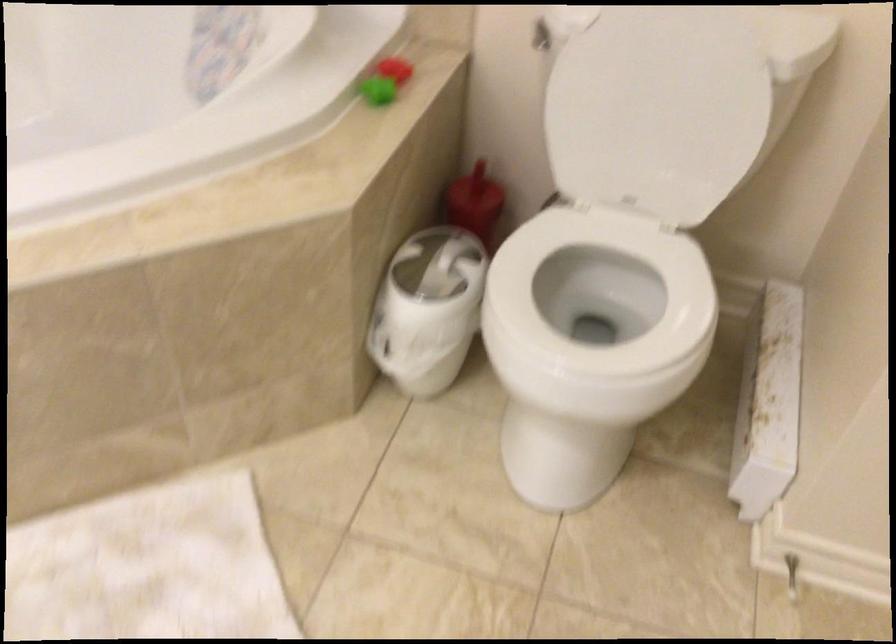
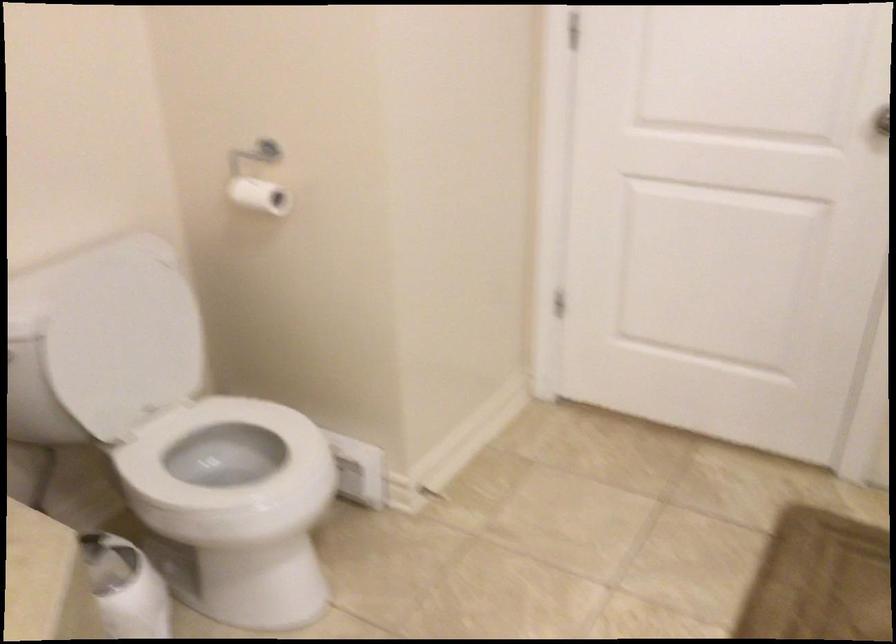
In the second image, find the point that corresponds to point 423,297 in the first image.

(125, 587)